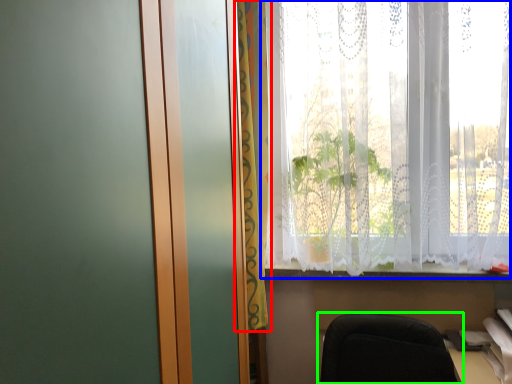
Question: Estimate the real-world distances between objects in this image. Which object is closer to curtain (highlighted by a red box), window (highlighted by a blue box) or chair (highlighted by a green box)?

Choices:
 (A) window
 (B) chair

Answer: (A)